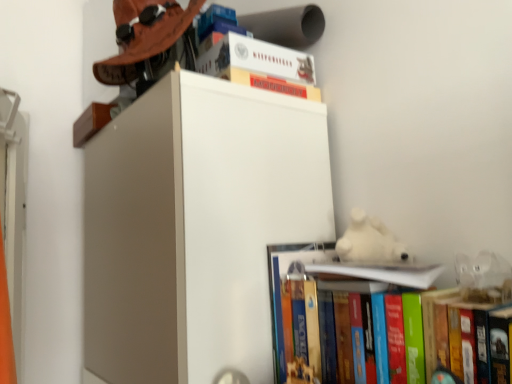
Question: Does hardcover book at upper center, arranged as the third book when ordered from the bottom, have a greater height compared to hardcover book at lower right, acting as the first book starting from the bottom?

Choices:
 (A) no
 (B) yes

Answer: (A)

Question: Is the depth of hardcover book at upper center, arranged as the third book when ordered from the bottom, greater than that of hardcover book at lower right, acting as the first book starting from the bottom?

Choices:
 (A) no
 (B) yes

Answer: (B)

Question: Is hardcover book at upper center, arranged as the third book when ordered from the bottom, looking in the opposite direction of hardcover book at lower right, acting as the first book starting from the bottom?

Choices:
 (A) no
 (B) yes

Answer: (A)

Question: From a real-world perspective, is hardcover book at upper center, arranged as the third book when ordered from the bottom, on top of hardcover book at lower right, which is counted as the third book, starting from the top?

Choices:
 (A) yes
 (B) no

Answer: (A)

Question: From the image's perspective, would you say hardcover book at upper center, arranged as the third book when ordered from the bottom, is shown under hardcover book at lower right, which is counted as the third book, starting from the top?

Choices:
 (A) yes
 (B) no

Answer: (B)

Question: From the image's perspective, is hardcover book at lower right, acting as the first book starting from the bottom, located above or below white plush bear at upper right?

Choices:
 (A) above
 (B) below

Answer: (B)

Question: From a real-world perspective, is hardcover book at lower right, which is counted as the third book, starting from the top, above or below white plush bear at upper right?

Choices:
 (A) above
 (B) below

Answer: (B)

Question: In the image, is hardcover book at lower right, acting as the first book starting from the bottom, positioned in front of or behind white plush bear at upper right?

Choices:
 (A) front
 (B) behind

Answer: (A)

Question: Is hardcover book at lower right, acting as the first book starting from the bottom, wider or thinner than white plush bear at upper right?

Choices:
 (A) wide
 (B) thin

Answer: (A)

Question: From the image's perspective, is hardcover book at lower right, which is counted as the third book, starting from the top, located above or below white paper at upper center, marked as the second book in a bottom-to-top arrangement?

Choices:
 (A) below
 (B) above

Answer: (A)

Question: Is hardcover book at lower right, which is counted as the third book, starting from the top, taller or shorter than white paper at upper center, acting as the second book starting from the top?

Choices:
 (A) tall
 (B) short

Answer: (A)

Question: In terms of width, does hardcover book at lower right, which is counted as the third book, starting from the top, look wider or thinner when compared to white paper at upper center, acting as the second book starting from the top?

Choices:
 (A) thin
 (B) wide

Answer: (B)

Question: Is point (331, 324) positioned closer to the camera than point (415, 284)?

Choices:
 (A) closer
 (B) farther

Answer: (B)

Question: Which is correct: white paper at upper center, marked as the second book in a bottom-to-top arrangement, is inside matte brown hat at upper left, or outside of it?

Choices:
 (A) outside
 (B) inside

Answer: (A)

Question: Is point (354, 276) positioned closer to the camera than point (309, 34)?

Choices:
 (A) farther
 (B) closer

Answer: (B)